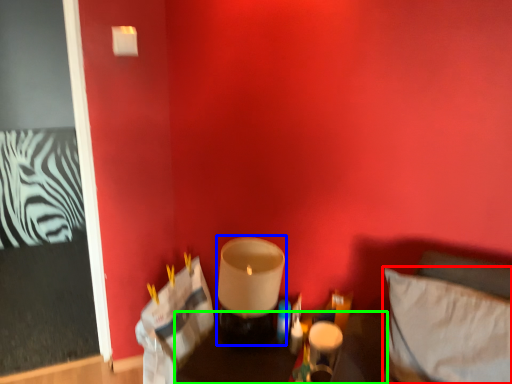
Question: Estimate the real-world distances between objects in this image. Which object is closer to pillow (highlighted by a red box), candle holder (highlighted by a blue box) or furniture (highlighted by a green box)?

Choices:
 (A) candle holder
 (B) furniture

Answer: (A)